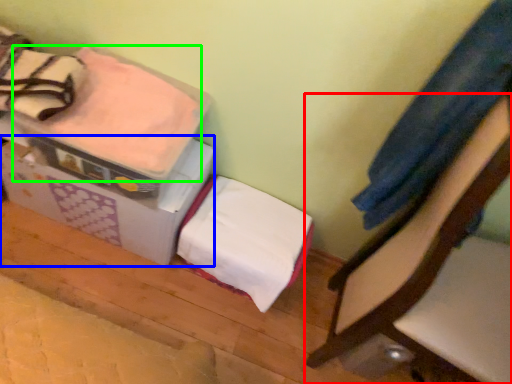
Question: Estimate the real-world distances between objects in this image. Which object is closer to furniture (highlighted by a red box), cardboard box (highlighted by a blue box) or blanket (highlighted by a green box)?

Choices:
 (A) cardboard box
 (B) blanket

Answer: (A)